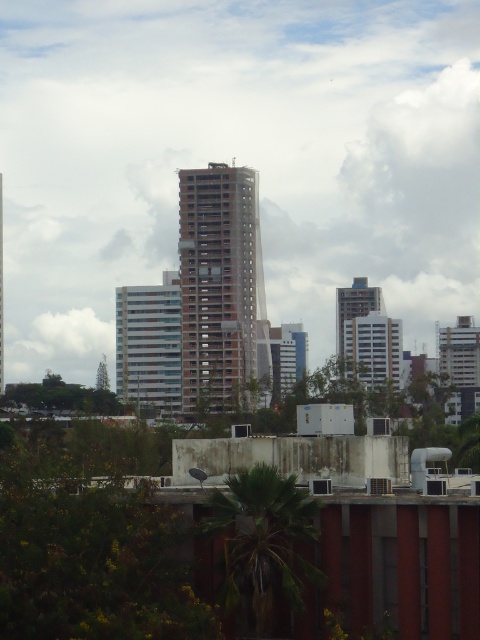
Which of these two, white glossy building at center or matte gray building at center, stands taller?

white glossy building at center

Looking at this image, who is positioned more to the left, white glossy building at center or matte gray building at center?

Positioned to the left is white glossy building at center.

Find the location of a particular element. This screenshot has width=480, height=640. white glossy building at center is located at coordinates (149, 346).

Between point (231, 404) and point (144, 317), which one is positioned in front?

Point (231, 404) is more forward.

Can you confirm if brown concrete building at center is thinner than white glossy building at center?

No, brown concrete building at center is not thinner than white glossy building at center.

Find the location of a particular element. Image resolution: width=480 pixels, height=640 pixels. brown concrete building at center is located at coordinates (219, 284).

Which is behind, point (184, 339) or point (348, 317)?

The point (348, 317) is more distant.

The width and height of the screenshot is (480, 640). Describe the element at coordinates (219, 284) in the screenshot. I see `brown concrete building at center` at that location.

Is point (192, 195) behind point (359, 296)?

No.

The image size is (480, 640). Find the location of `brown concrete building at center`. brown concrete building at center is located at coordinates (219, 284).